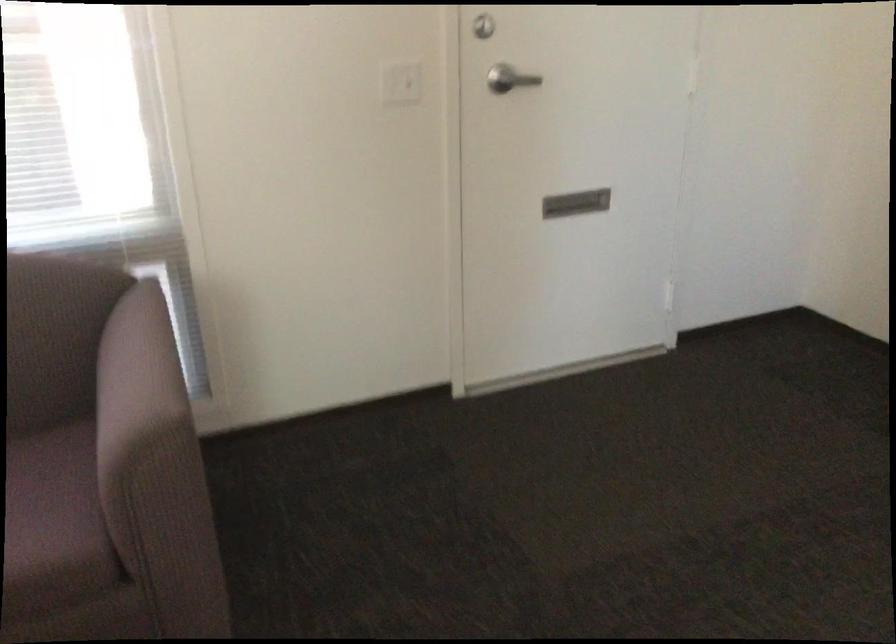
Where would you insert the door mail slot? Please return your answer as a coordinate pair (x, y).

(575, 203)